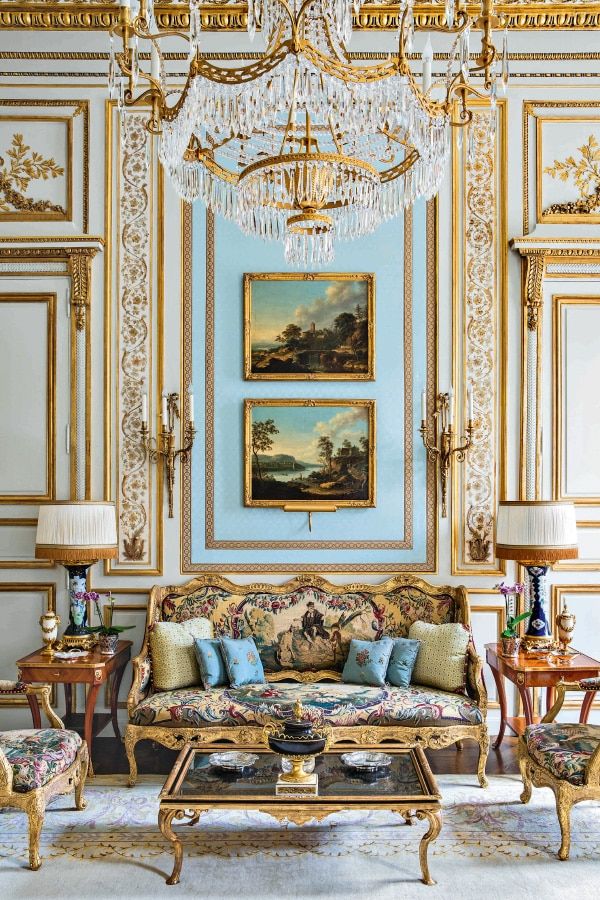
I want to click on paintings, so click(311, 335), click(302, 423).